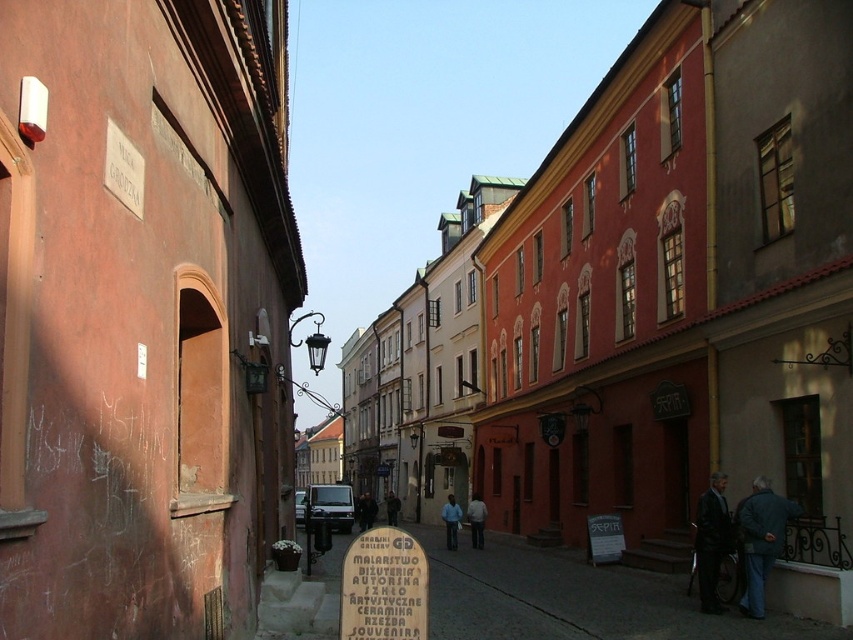
Question: Which point is closer to the camera?

Choices:
 (A) white paper sign at center
 (B) wooden signboard at center
 (C) blue denim jacket at lower right
 (D) dark gray jacket at center

Answer: (B)

Question: Which point appears closest to the camera in this image?

Choices:
 (A) [x=624, y=548]
 (B) [x=451, y=500]

Answer: (A)

Question: Can you confirm if stone signboard at center is positioned above dark blue jacket at center?

Choices:
 (A) no
 (B) yes

Answer: (B)

Question: Where is stone signboard at center located in relation to wooden signboard at center in the image?

Choices:
 (A) above
 (B) below

Answer: (B)

Question: Which point is farther to the camera?

Choices:
 (A) (610, 554)
 (B) (368, 515)

Answer: (B)

Question: Does blue denim jacket at lower right appear over white paper sign at center?

Choices:
 (A) yes
 (B) no

Answer: (A)